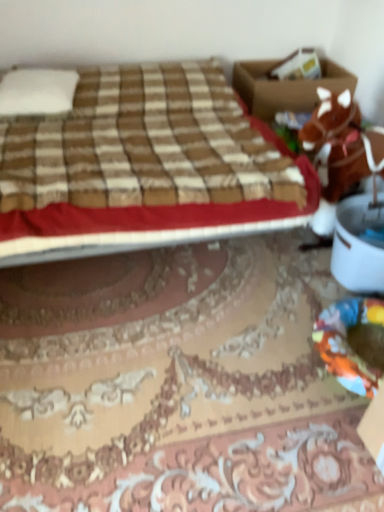
This screenshot has height=512, width=384. Describe the element at coordinates (37, 91) in the screenshot. I see `white soft pillow at upper left` at that location.

Find the location of `brown cardboard box at upper right`. brown cardboard box at upper right is located at coordinates (285, 87).

Identify the location of white soft pillow at upper left. The width and height of the screenshot is (384, 512). (37, 91).

Is white soft pillow at upper left spatially inside brown plaid bed at upper left, or outside of it?

white soft pillow at upper left is located inside brown plaid bed at upper left.

Is white soft pillow at upper left smaller than brown plaid bed at upper left?

Indeed, white soft pillow at upper left has a smaller size compared to brown plaid bed at upper left.

In the scene shown: Considering the positions of objects white soft pillow at upper left and brown plaid bed at upper left in the image provided, who is in front, white soft pillow at upper left or brown plaid bed at upper left?

brown plaid bed at upper left.

From a real-world perspective, relative to brown plaid bed at upper left, is white soft pillow at upper left vertically above or below?

white soft pillow at upper left is above brown plaid bed at upper left.

Considering the sizes of objects brown plush horse at right and white soft pillow at upper left in the image provided, who is shorter, brown plush horse at right or white soft pillow at upper left?

With less height is white soft pillow at upper left.

Is brown plush horse at right oriented away from white soft pillow at upper left?

No, brown plush horse at right's orientation is not away from white soft pillow at upper left.

Can you confirm if brown plush horse at right is bigger than white soft pillow at upper left?

Indeed, brown plush horse at right has a larger size compared to white soft pillow at upper left.

In terms of width, does brown plush horse at right look wider or thinner when compared to white soft pillow at upper left?

brown plush horse at right is thinner than white soft pillow at upper left.

Does brown plaid bed at upper left have a greater width compared to white soft pillow at upper left?

Yes.

From the image's perspective, is brown plaid bed at upper left positioned above or below white soft pillow at upper left?

brown plaid bed at upper left is below white soft pillow at upper left.

Considering the relative sizes of brown plaid bed at upper left and white soft pillow at upper left in the image provided, is brown plaid bed at upper left taller than white soft pillow at upper left?

Correct, brown plaid bed at upper left is much taller as white soft pillow at upper left.

Image resolution: width=384 pixels, height=512 pixels. What are the coordinates of `bed that appears below the white soft pillow at upper left (from the image's perspective)` in the screenshot? It's located at (145, 167).

You are a GUI agent. You are given a task and a screenshot of the screen. Output one action in this format:
    pyautogui.click(x=<x>, y=<y>)
    Task: Click on the animal lying on the right of brown cardboard box at upper right
    This screenshot has height=512, width=384.
    Given the screenshot: What is the action you would take?
    pyautogui.click(x=338, y=151)

Between brown cardboard box at upper right and brown plush horse at right, which one appears on the right side from the viewer's perspective?

Positioned to the right is brown plush horse at right.

How far apart are brown cardboard box at upper right and brown plush horse at right?

brown cardboard box at upper right and brown plush horse at right are 24.49 inches apart from each other.

Consider the image. Can you confirm if brown cardboard box at upper right is wider than brown plush horse at right?

Correct, the width of brown cardboard box at upper right exceeds that of brown plush horse at right.

Is white soft pillow at upper left not within brown cardboard box at upper right?

Absolutely, white soft pillow at upper left is external to brown cardboard box at upper right.

In the scene shown: Can you confirm if white soft pillow at upper left is positioned to the left of brown cardboard box at upper right?

Yes.

Considering the relative sizes of white soft pillow at upper left and brown cardboard box at upper right in the image provided, is white soft pillow at upper left taller than brown cardboard box at upper right?

No.

Is white soft pillow at upper left aimed at brown cardboard box at upper right?

No.

From the image's perspective, is brown cardboard box at upper right below brown plaid bed at upper left?

No, from the image's perspective, brown cardboard box at upper right is not below brown plaid bed at upper left.

Considering the relative sizes of brown cardboard box at upper right and brown plaid bed at upper left in the image provided, is brown cardboard box at upper right thinner than brown plaid bed at upper left?

Indeed, brown cardboard box at upper right has a lesser width compared to brown plaid bed at upper left.

Considering the relative sizes of brown cardboard box at upper right and brown plaid bed at upper left in the image provided, is brown cardboard box at upper right shorter than brown plaid bed at upper left?

Correct, brown cardboard box at upper right is not as tall as brown plaid bed at upper left.

Which is more to the right, brown cardboard box at upper right or brown plaid bed at upper left?

brown cardboard box at upper right.

Considering the relative sizes of brown plaid bed at upper left and brown plush horse at right in the image provided, is brown plaid bed at upper left shorter than brown plush horse at right?

Indeed, brown plaid bed at upper left has a lesser height compared to brown plush horse at right.

Is brown plaid bed at upper left smaller than brown plush horse at right?

Actually, brown plaid bed at upper left might be larger than brown plush horse at right.

From the image's perspective, does brown plaid bed at upper left appear lower than brown plush horse at right?

Actually, brown plaid bed at upper left appears above brown plush horse at right in the image.

From a real-world perspective, is brown plaid bed at upper left over brown plush horse at right?

No, from a real-world perspective, brown plaid bed at upper left is not on top of brown plush horse at right.

The width and height of the screenshot is (384, 512). What are the coordinates of `pillow that appears behind the brown plaid bed at upper left` in the screenshot? It's located at click(37, 91).

The image size is (384, 512). In order to click on animal below the white soft pillow at upper left (from a real-world perspective) in this screenshot , I will do `click(338, 151)`.

From the image, which object appears to be nearer to white soft pillow at upper left, brown plush horse at right or brown plaid bed at upper left?

Based on the image, brown plaid bed at upper left appears to be nearer to white soft pillow at upper left.

Looking at the image, which one is located closer to white soft pillow at upper left, brown cardboard box at upper right or brown plaid bed at upper left?

brown plaid bed at upper left is closer to white soft pillow at upper left.

When comparing their distances from brown cardboard box at upper right, does brown plush horse at right or brown plaid bed at upper left seem closer?

Based on the image, brown plush horse at right appears to be nearer to brown cardboard box at upper right.

Which object lies nearer to the anchor point brown plush horse at right, brown plaid bed at upper left or white soft pillow at upper left?

brown plaid bed at upper left is positioned closer to the anchor brown plush horse at right.

Considering their positions, is brown plaid bed at upper left positioned closer to brown cardboard box at upper right than white soft pillow at upper left?

brown plaid bed at upper left lies closer to brown cardboard box at upper right than the other object.

Looking at the image, which one is located closer to brown plaid bed at upper left, white soft pillow at upper left or brown cardboard box at upper right?

white soft pillow at upper left is positioned closer to the anchor brown plaid bed at upper left.

From the image, which object appears to be nearer to brown plush horse at right, brown cardboard box at upper right or white soft pillow at upper left?

brown cardboard box at upper right is closer to brown plush horse at right.

From the image, which object appears to be nearer to white soft pillow at upper left, brown plaid bed at upper left or brown plush horse at right?

brown plaid bed at upper left is closer to white soft pillow at upper left.

Where is `animal between brown plaid bed at upper left and brown cardboard box at upper right along the z-axis`? This screenshot has width=384, height=512. animal between brown plaid bed at upper left and brown cardboard box at upper right along the z-axis is located at coordinates (338, 151).

The height and width of the screenshot is (512, 384). I want to click on box located between white soft pillow at upper left and brown plush horse at right in the left-right direction, so click(285, 87).

At what (x,y) coordinates should I click in order to perform the action: click on bed between white soft pillow at upper left and brown plush horse at right from left to right. Please return your answer as a coordinate pair (x, y). Looking at the image, I should click on (145, 167).

Image resolution: width=384 pixels, height=512 pixels. Identify the location of bed between white soft pillow at upper left and brown cardboard box at upper right. (145, 167).